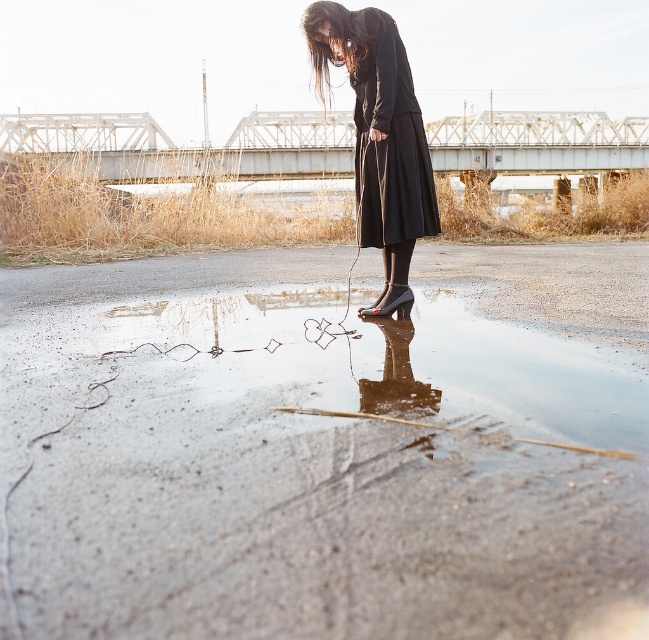
From the picture: Who is higher up, glossy concrete puddle at center or black matte dress at center?

black matte dress at center is higher up.

Who is positioned more to the right, glossy concrete puddle at center or black matte dress at center?

black matte dress at center

Is point (326, 420) closer to viewer compared to point (397, 214)?

Yes, it is.

This screenshot has width=649, height=640. In order to click on glossy concrete puddle at center in this screenshot , I will do `click(312, 474)`.

Can you confirm if glossy concrete puddle at center is shorter than matte black dress at center?

Correct, glossy concrete puddle at center is not as tall as matte black dress at center.

Between glossy concrete puddle at center and matte black dress at center, which one is positioned higher?

matte black dress at center

This screenshot has width=649, height=640. Describe the element at coordinates (312, 474) in the screenshot. I see `glossy concrete puddle at center` at that location.

This screenshot has height=640, width=649. What are the coordinates of `glossy concrete puddle at center` in the screenshot? It's located at pos(312,474).

Which is behind, point (387, 285) or point (384, 124)?

Point (387, 285)

Find the location of a particular element. matte black dress at center is located at coordinates (380, 136).

Between point (373, 170) and point (424, 186), which one is positioned behind?

Positioned behind is point (373, 170).

Where is `matte black dress at center`? matte black dress at center is located at coordinates (380, 136).